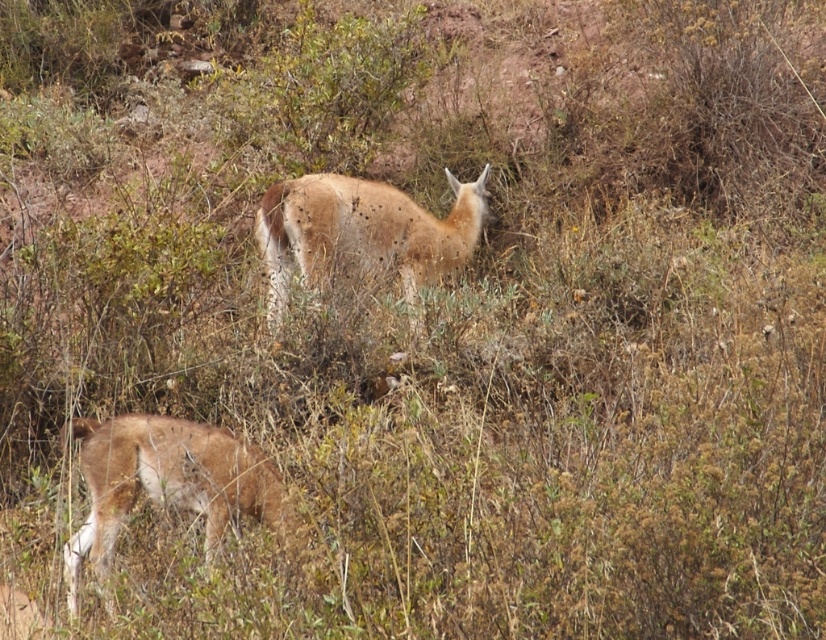
You are a wildlife photographer aiming to capture both the brown furry antelope at lower left and the spotted fur antelope at center in a single frame. Based on their positions, which antelope is closer to the left edge of your camera view?

The brown furry antelope at lower left is positioned on the left side of the spotted fur antelope at center, so it is closer to the left edge of the camera view.

You are a wildlife photographer trying to capture a photo of both the brown furry antelope at lower left and the spotted fur antelope at center. Since you want both animals to appear in the frame, which antelope should you focus on to ensure both are visible?

The brown furry antelope at lower left is smaller than the spotted fur antelope at center. To ensure both are visible in the frame, focus on the spotted fur antelope at center as the larger animal will occupy more space, allowing the smaller one to fit alongside.

You are a wildlife photographer aiming to capture a clear photo of both the brown furry antelope at lower left and the spotted fur antelope at center. Considering their heights, which antelope might be more challenging to frame in the same shot without cropping?

The brown furry antelope at lower left is shorter than the spotted fur antelope at center, so it might be more challenging to frame the brown furry antelope at lower left in the same shot without cropping because of its smaller size.